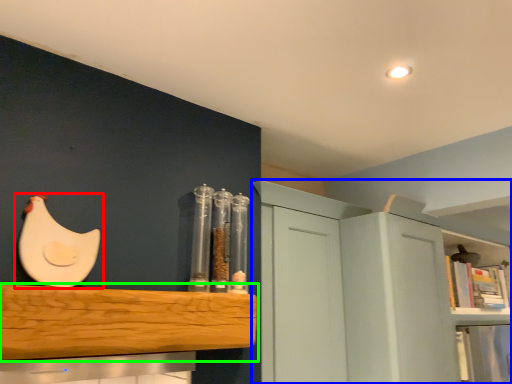
Question: Based on their relative distances, which object is farther from chicken (highlighted by a red box)? Choose from cabinetry (highlighted by a blue box) and shelf (highlighted by a green box).

Choices:
 (A) cabinetry
 (B) shelf

Answer: (A)